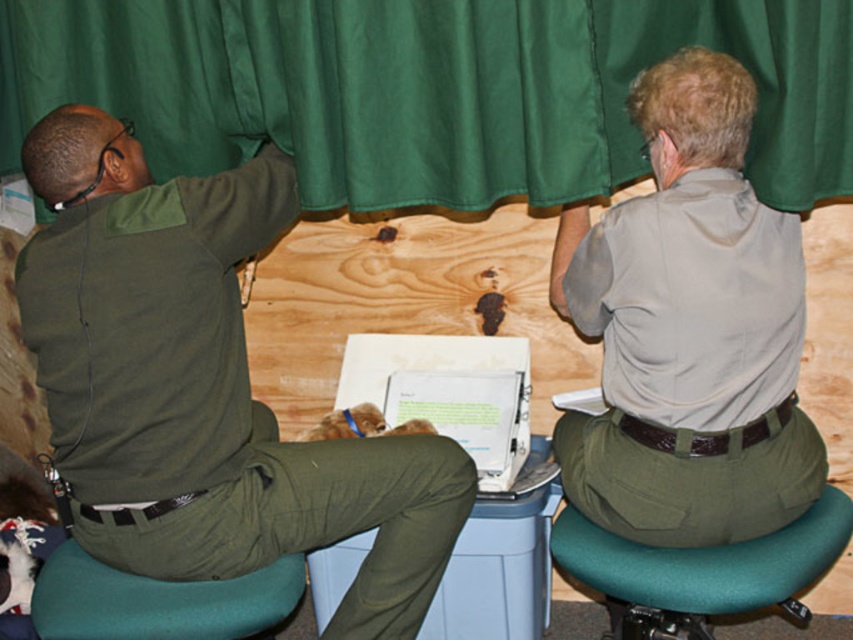
You are standing at the point labeled as point [645,628] and want to move to the point labeled as point [730,86]. Which direction should you move to reach your destination?

You should move forward because point [730,86] is in front of point [645,628].

From the picture: You are a delivery person who needs to place a large package on the teal fabric bar stool at lower left. However, the green fabric curtain at upper center is in the way. Can you lift the curtain to make space?

The green fabric curtain at upper center is above the teal fabric bar stool at lower left, so you can lift the curtain to make space for placing the large package on the teal fabric bar stool at lower left.

You are standing at the center of the scene and need to reach the green fabric bar stool at lower right. Which direction should you move to get there?

To reach the green fabric bar stool at lower right, you should move towards the lower right direction since it is located at point (701, 572) in the scene.